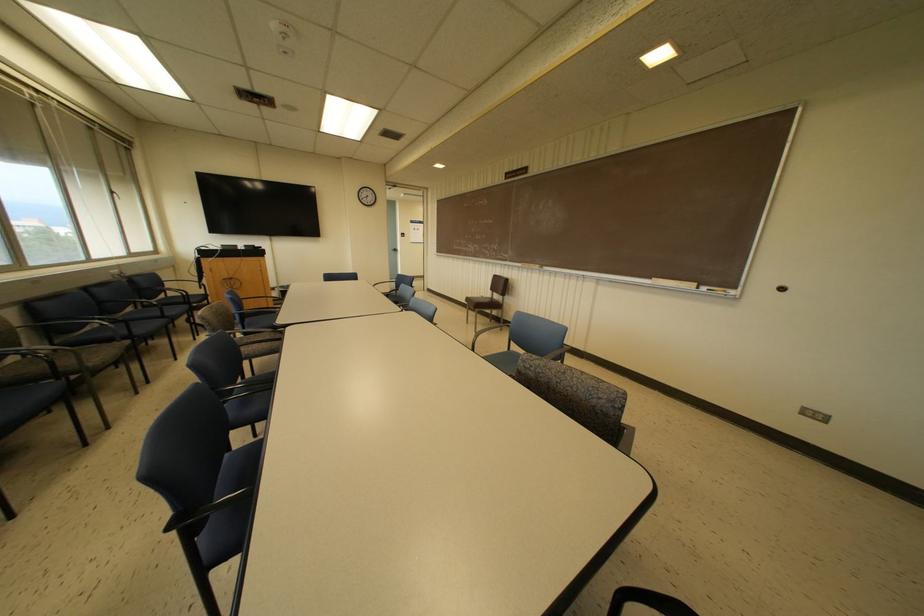
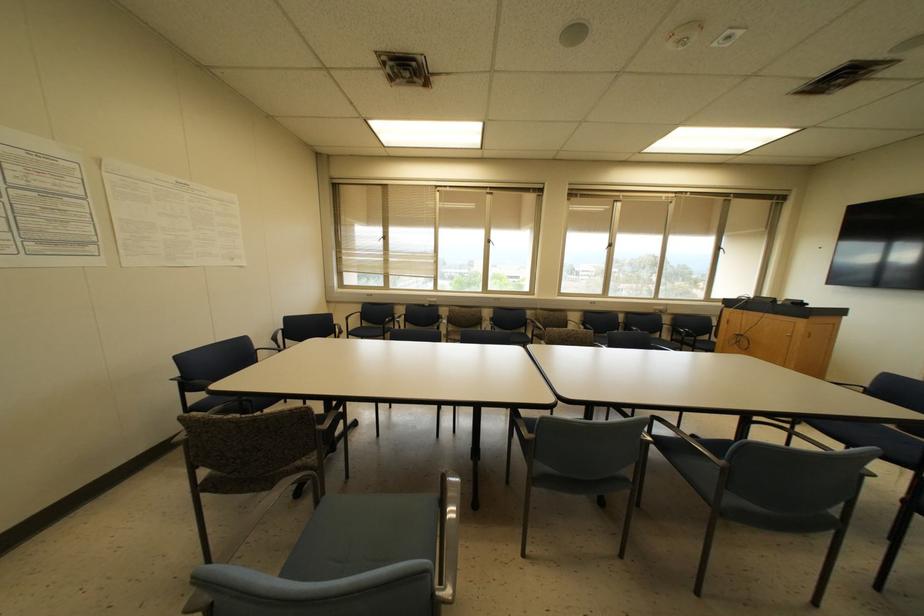
Question: I am providing you with two images of the same scene from different viewpoints. Which of the following objects are not visible in image2?

Choices:
 (A) light pulley handle
 (B) chair armrest
 (C) chair sitting surface
 (D) black chair armrest

Answer: (D)